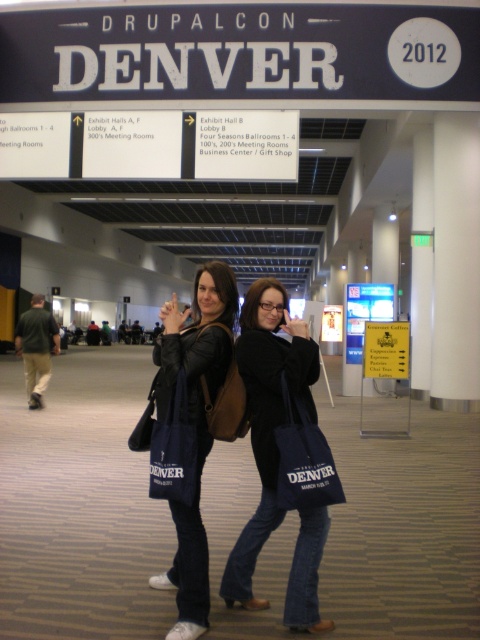
Based on the photo, you are a photographer at DrupalCon Denver 2012. You need to capture a photo of both the matte black jacket at center and the dark blue canvas bag at center in the same frame. Based on their sizes, which object will appear bigger in the photo?

The matte black jacket at center will appear bigger in the photo because it is larger in size than the dark blue canvas bag at center.

You are an event organizer at DrupalCon Denver 2012 and need to place a promotional banner. The banner must be positioned exactly at the center of the image. Is the matte black tote bag at center located at the center of the image?

The 2D location of the matte black tote bag at center is at point (266, 417), which is not the exact center of the image. The exact center would be at coordinates (240, 320). Therefore, the matte black tote bag at center is slightly to the right and above the true center of the image.